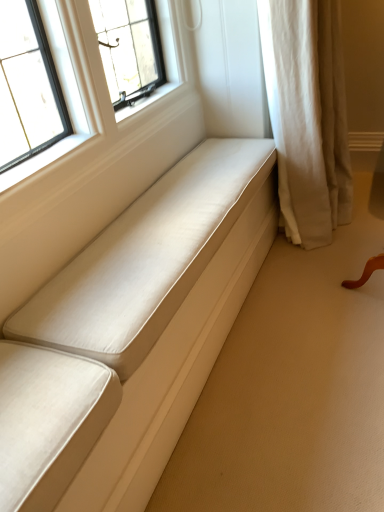
I want to click on empty space that is ontop of matte white cushion at center (from a real-world perspective), so click(172, 208).